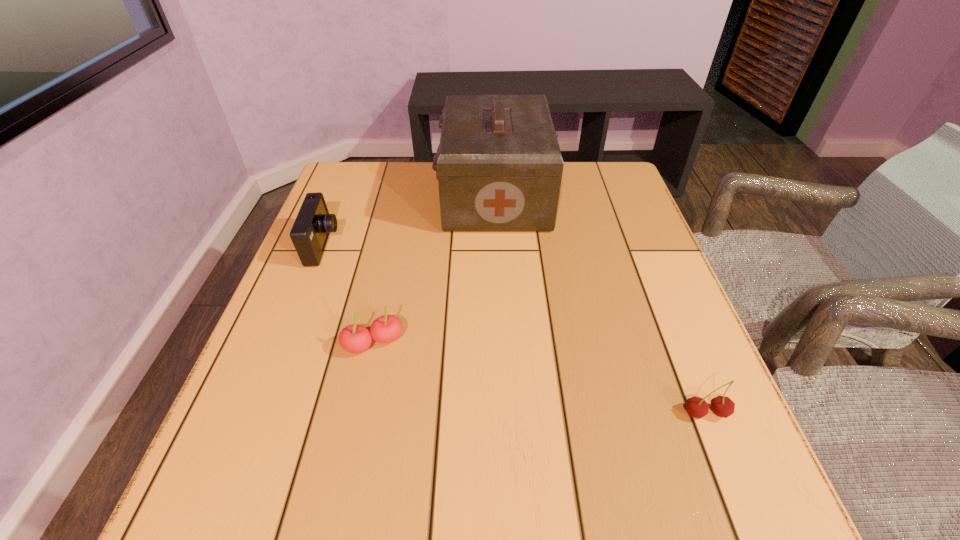
Find the location of a particular element. The height and width of the screenshot is (540, 960). object that ranks as the closest to the third farthest object is located at coordinates (310, 232).

Find the location of a particular element. The image size is (960, 540). the second closest object relative to the tallest object is located at coordinates (355, 339).

The width and height of the screenshot is (960, 540). I want to click on free space that satisfies the following two spatial constraints: 1. on the front-facing side of the camera; 2. on the left side of the farther cherry, so click(x=285, y=343).